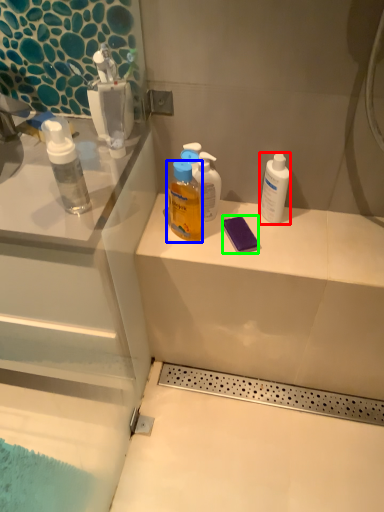
Question: Estimate the real-world distances between objects in this image. Which object is closer to mouthwash (highlighted by a red box), bottle (highlighted by a blue box) or soap (highlighted by a green box)?

Choices:
 (A) bottle
 (B) soap

Answer: (B)